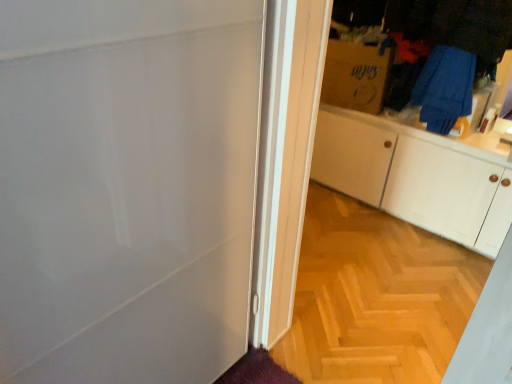
Describe the element at coordinates (444, 88) in the screenshot. This screenshot has width=512, height=384. I see `blue fabric laundry at upper right, the second laundry positioned from the top` at that location.

What do you see at coordinates (376, 296) in the screenshot?
I see `wooden floor at center` at bounding box center [376, 296].

The image size is (512, 384). What do you see at coordinates (414, 177) in the screenshot? I see `white matte cabinet at right` at bounding box center [414, 177].

Find the location of a particular element. blue fabric laundry at upper right, the first laundry in the bottom-to-top sequence is located at coordinates (444, 88).

Can wooden floor at center be found inside white matte cabinet at right?

That's incorrect, wooden floor at center is not inside white matte cabinet at right.

Would you consider white matte cabinet at right to be distant from wooden floor at center?

No, white matte cabinet at right is not far from wooden floor at center.

In terms of height, does white matte cabinet at right look taller or shorter compared to wooden floor at center?

Considering their sizes, white matte cabinet at right has more height than wooden floor at center.

Considering the positions of points (360, 117) and (432, 364), is point (360, 117) farther from camera compared to point (432, 364)?

That is True.

Considering the relative sizes of brown cardboard box at upper right and blue fabric laundry at upper right, the first laundry in the bottom-to-top sequence, in the image provided, is brown cardboard box at upper right thinner than blue fabric laundry at upper right, the first laundry in the bottom-to-top sequence,?

Yes.

What's the angular difference between brown cardboard box at upper right and blue fabric laundry at upper right, the second laundry positioned from the top,'s facing directions?

brown cardboard box at upper right and blue fabric laundry at upper right, the second laundry positioned from the top, are facing 14.1 degrees away from each other.

Consider the image. Can blue fabric laundry at upper right, the second laundry positioned from the top, be found inside brown cardboard box at upper right?

No, blue fabric laundry at upper right, the second laundry positioned from the top, is not inside brown cardboard box at upper right.

Is wooden floor at center bigger or smaller than blue fabric at upper right, which is counted as the 1th laundry, starting from the top?

Considering their sizes, wooden floor at center takes up less space than blue fabric at upper right, which is counted as the 1th laundry, starting from the top.

Does wooden floor at center appear on the right side of blue fabric at upper right, which is the 2th laundry from bottom to top?

No, wooden floor at center is not to the right of blue fabric at upper right, which is the 2th laundry from bottom to top.

From the image's perspective, would you say wooden floor at center is positioned over blue fabric at upper right, which is counted as the 1th laundry, starting from the top?

No.

Is brown cardboard box at upper right shorter than wooden floor at center?

Incorrect, the height of brown cardboard box at upper right does not fall short of that of wooden floor at center.

Is brown cardboard box at upper right located outside wooden floor at center?

Absolutely, brown cardboard box at upper right is external to wooden floor at center.

Which object is positioned more to the left, brown cardboard box at upper right or wooden floor at center?

Positioned to the left is wooden floor at center.

Can you tell me how much brown cardboard box at upper right and wooden floor at center differ in facing direction?

They differ by 13 degrees in their facing directions.

Would you say wooden floor at center is to the left or to the right of brown cardboard box at upper right in the picture?

Clearly, wooden floor at center is on the left of brown cardboard box at upper right in the image.

Is wooden floor at center wider or thinner than brown cardboard box at upper right?

wooden floor at center is wider than brown cardboard box at upper right.

How different are the orientations of blue fabric at upper right, which is counted as the 1th laundry, starting from the top, and wooden floor at center in degrees?

There is a 1.05-degree angle between the facing directions of blue fabric at upper right, which is counted as the 1th laundry, starting from the top, and wooden floor at center.

There is a wooden floor at center. Where is `the 2nd laundry above it (from the image's perspective)`? Image resolution: width=512 pixels, height=384 pixels. the 2nd laundry above it (from the image's perspective) is located at coordinates (451, 50).

Is the surface of blue fabric at upper right, which is the 2th laundry from bottom to top, in direct contact with wooden floor at center?

No, blue fabric at upper right, which is the 2th laundry from bottom to top, is not touching wooden floor at center.

Considering the points (433, 103) and (298, 329), which point is behind, point (433, 103) or point (298, 329)?

The point (433, 103) is behind.

From a real-world perspective, who is located higher, blue fabric laundry at upper right, the first laundry in the bottom-to-top sequence, or blue fabric at upper right, which is the 2th laundry from bottom to top?

blue fabric at upper right, which is the 2th laundry from bottom to top.

Which object is thinner, blue fabric laundry at upper right, the first laundry in the bottom-to-top sequence, or blue fabric at upper right, which is counted as the 1th laundry, starting from the top?

Thinner between the two is blue fabric laundry at upper right, the first laundry in the bottom-to-top sequence.

Considering the points (456, 98) and (486, 63), which point is in front, point (456, 98) or point (486, 63)?

The point (486, 63) is in front.

Is blue fabric laundry at upper right, the first laundry in the bottom-to-top sequence, surrounding blue fabric at upper right, which is the 2th laundry from bottom to top?

That's incorrect, blue fabric at upper right, which is the 2th laundry from bottom to top, is not inside blue fabric laundry at upper right, the first laundry in the bottom-to-top sequence.

Locate an element on the screen. cabinetry that is on the right side of wooden floor at center is located at coordinates (414, 177).

Identify the location of cardboard box behind the blue fabric laundry at upper right, the first laundry in the bottom-to-top sequence. The height and width of the screenshot is (384, 512). (355, 76).

Estimate the real-world distances between objects in this image. Which object is closer to white matte cabinet at right, blue fabric at upper right, which is counted as the 1th laundry, starting from the top, or blue fabric laundry at upper right, the first laundry in the bottom-to-top sequence?

blue fabric laundry at upper right, the first laundry in the bottom-to-top sequence, is closer to white matte cabinet at right.

When comparing their distances from wooden floor at center, does blue fabric at upper right, which is the 2th laundry from bottom to top, or blue fabric laundry at upper right, the second laundry positioned from the top, seem further?

blue fabric at upper right, which is the 2th laundry from bottom to top, is positioned further to the anchor wooden floor at center.

Looking at the image, which one is located closer to blue fabric laundry at upper right, the second laundry positioned from the top, blue fabric at upper right, which is the 2th laundry from bottom to top, or brown cardboard box at upper right?

blue fabric at upper right, which is the 2th laundry from bottom to top.

Estimate the real-world distances between objects in this image. Which object is further from brown cardboard box at upper right, blue fabric at upper right, which is the 2th laundry from bottom to top, or white matte cabinet at right?

white matte cabinet at right lies further to brown cardboard box at upper right than the other object.

Estimate the real-world distances between objects in this image. Which object is closer to wooden floor at center, brown cardboard box at upper right or blue fabric laundry at upper right, the second laundry positioned from the top?

blue fabric laundry at upper right, the second laundry positioned from the top, is positioned closer to the anchor wooden floor at center.

Estimate the real-world distances between objects in this image. Which object is further from blue fabric laundry at upper right, the first laundry in the bottom-to-top sequence, brown cardboard box at upper right or wooden floor at center?

Among the two, wooden floor at center is located further to blue fabric laundry at upper right, the first laundry in the bottom-to-top sequence.

When comparing their distances from white matte cabinet at right, does blue fabric laundry at upper right, the first laundry in the bottom-to-top sequence, or wooden floor at center seem closer?

blue fabric laundry at upper right, the first laundry in the bottom-to-top sequence, lies closer to white matte cabinet at right than the other object.

Which object lies further to the anchor point white matte cabinet at right, wooden floor at center or blue fabric laundry at upper right, the second laundry positioned from the top?

wooden floor at center lies further to white matte cabinet at right than the other object.

Locate an element on the screen. This screenshot has width=512, height=384. cabinetry between brown cardboard box at upper right and wooden floor at center from top to bottom is located at coordinates (414, 177).

Locate an element on the screen. cabinetry that lies between blue fabric at upper right, which is the 2th laundry from bottom to top, and wooden floor at center from top to bottom is located at coordinates (414, 177).

The width and height of the screenshot is (512, 384). In order to click on laundry between white matte cabinet at right and blue fabric laundry at upper right, the first laundry in the bottom-to-top sequence, from front to back in this screenshot , I will do `click(451, 50)`.

You are a GUI agent. You are given a task and a screenshot of the screen. Output one action in this format:
    pyautogui.click(x=<x>, y=<y>)
    Task: Click on the laundry between blue fabric at upper right, which is counted as the 1th laundry, starting from the top, and brown cardboard box at upper right from front to back
    
    Given the screenshot: What is the action you would take?
    pyautogui.click(x=444, y=88)